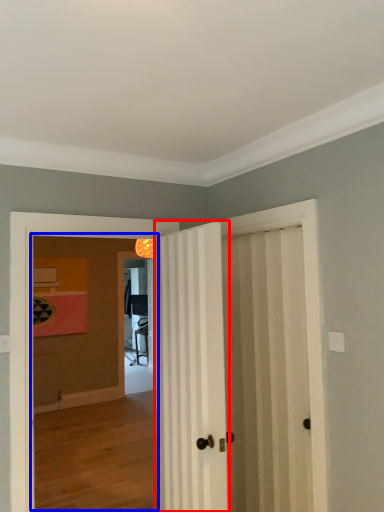
Question: Which object is closer to the camera taking this photo, door (highlighted by a red box) or corridor (highlighted by a blue box)?

Choices:
 (A) door
 (B) corridor

Answer: (A)